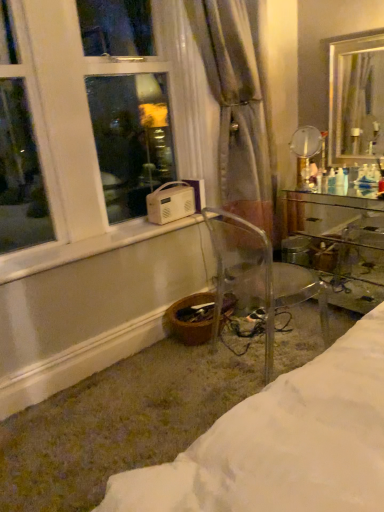
Question: Could you tell me if transparent plastic chair at lower center is turned towards clear glass desk at right?

Choices:
 (A) yes
 (B) no

Answer: (A)

Question: Can you confirm if transparent plastic chair at lower center is positioned to the right of clear glass desk at right?

Choices:
 (A) no
 (B) yes

Answer: (A)

Question: Considering the relative sizes of transparent plastic chair at lower center and clear glass desk at right in the image provided, is transparent plastic chair at lower center smaller than clear glass desk at right?

Choices:
 (A) no
 (B) yes

Answer: (A)

Question: From a real-world perspective, is transparent plastic chair at lower center beneath clear glass desk at right?

Choices:
 (A) yes
 (B) no

Answer: (B)

Question: Is transparent plastic chair at lower center closer to the viewer compared to clear glass desk at right?

Choices:
 (A) yes
 (B) no

Answer: (A)

Question: Is transparent plastic chair at lower center located outside clear glass desk at right?

Choices:
 (A) yes
 (B) no

Answer: (A)

Question: Can you confirm if translucent fabric curtain at center is shorter than clear glass mirror at upper right, acting as the 1th mirror starting from the left?

Choices:
 (A) yes
 (B) no

Answer: (B)

Question: From a real-world perspective, is translucent fabric curtain at center under clear glass mirror at upper right, acting as the 1th mirror starting from the left?

Choices:
 (A) yes
 (B) no

Answer: (B)

Question: Does translucent fabric curtain at center appear on the right side of clear glass mirror at upper right, marked as the 2th mirror in a right-to-left arrangement?

Choices:
 (A) no
 (B) yes

Answer: (A)

Question: From a real-world perspective, is translucent fabric curtain at center positioned over clear glass mirror at upper right, marked as the 2th mirror in a right-to-left arrangement, based on gravity?

Choices:
 (A) yes
 (B) no

Answer: (A)

Question: Is translucent fabric curtain at center positioned far away from clear glass mirror at upper right, acting as the 1th mirror starting from the left?

Choices:
 (A) no
 (B) yes

Answer: (A)

Question: Can you confirm if translucent fabric curtain at center is taller than clear glass mirror at upper right, marked as the 2th mirror in a right-to-left arrangement?

Choices:
 (A) no
 (B) yes

Answer: (B)

Question: Would you say metallic gold mirror at upper right, the second mirror in the left-to-right sequence, is part of transparent plastic chair at lower center's contents?

Choices:
 (A) yes
 (B) no

Answer: (B)